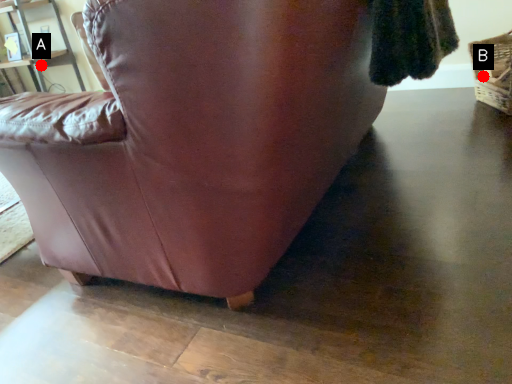
Question: Two points are circled on the image, labeled by A and B beside each circle. Which of the following is the closest to the observer?

Choices:
 (A) A is closer
 (B) B is closer

Answer: (B)